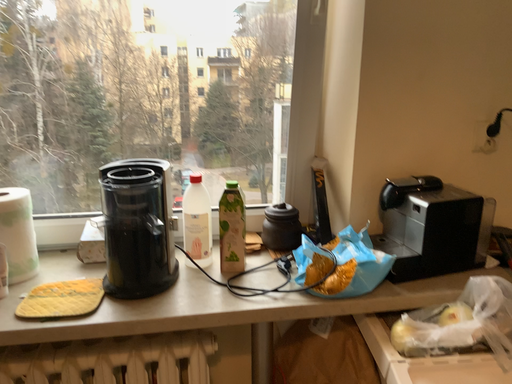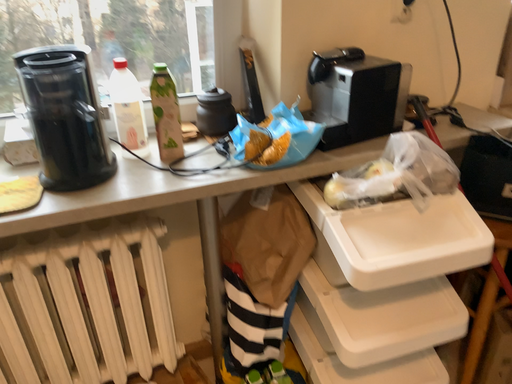
Question: How did the camera likely rotate when shooting the video?

Choices:
 (A) rotated right
 (B) rotated left

Answer: (A)